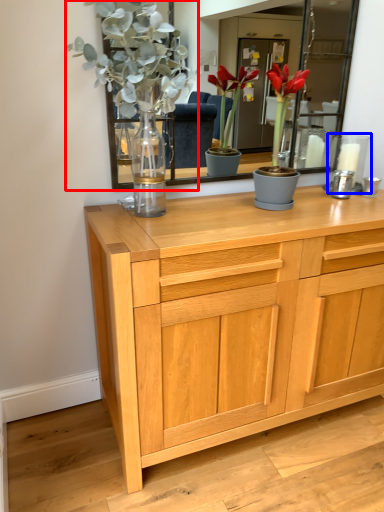
Question: Among these objects, which one is farthest to the camera, floral arrangement (highlighted by a red box) or candle holder (highlighted by a blue box)?

Choices:
 (A) floral arrangement
 (B) candle holder

Answer: (B)